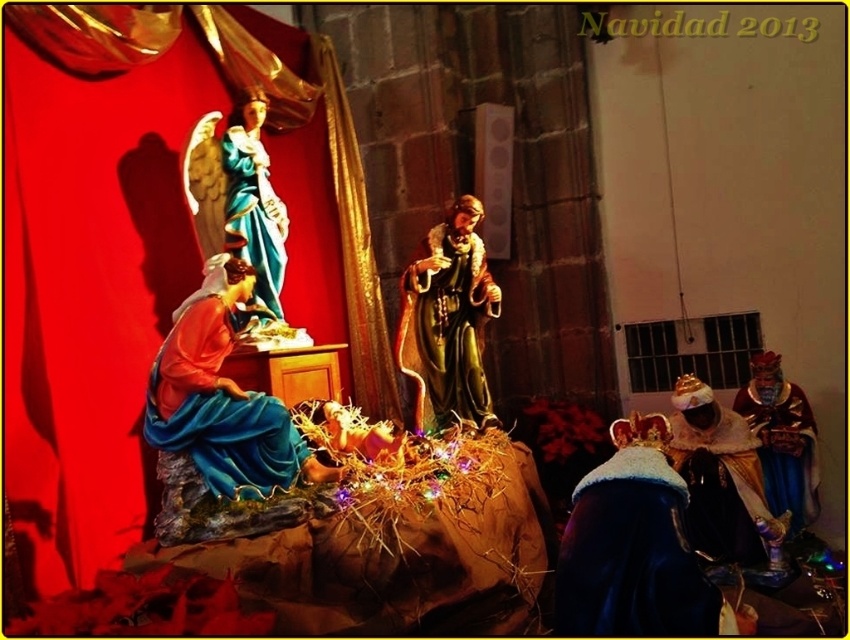
This screenshot has height=640, width=850. Describe the element at coordinates (446, 321) in the screenshot. I see `shiny gold statue at center` at that location.

Is point (434, 257) more distant than point (748, 397)?

No, (434, 257) is in front of (748, 397).

The width and height of the screenshot is (850, 640). I want to click on shiny gold statue at center, so click(x=446, y=321).

Which is below, matte blue statue at upper left or shiny gold crown at lower right?

shiny gold crown at lower right is lower down.

Is point (278, 301) behind point (774, 435)?

No, it is not.

The width and height of the screenshot is (850, 640). What are the coordinates of `matte blue statue at upper left` in the screenshot? It's located at (253, 209).

Is matte blue fabric at center to the left of shiny gold crown at lower right from the viewer's perspective?

Correct, you'll find matte blue fabric at center to the left of shiny gold crown at lower right.

Describe the element at coordinates (222, 397) in the screenshot. The width and height of the screenshot is (850, 640). I see `matte blue fabric at center` at that location.

What are the coordinates of `matte blue fabric at center` in the screenshot? It's located at (222, 397).